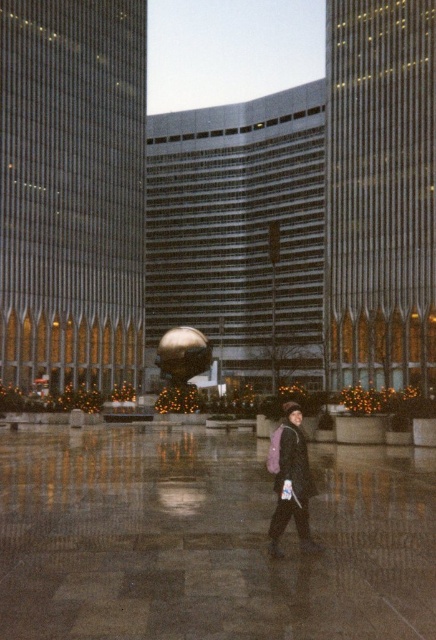
Is point (180, 620) less distant than point (302, 476)?

Yes, point (180, 620) is closer to viewer.

This screenshot has height=640, width=436. I want to click on polished stone pavement at center, so click(207, 540).

Between point (106, 504) and point (307, 506), which one is positioned in front?

Point (307, 506) is more forward.

This screenshot has width=436, height=640. In order to click on polished stone pavement at center in this screenshot , I will do `click(207, 540)`.